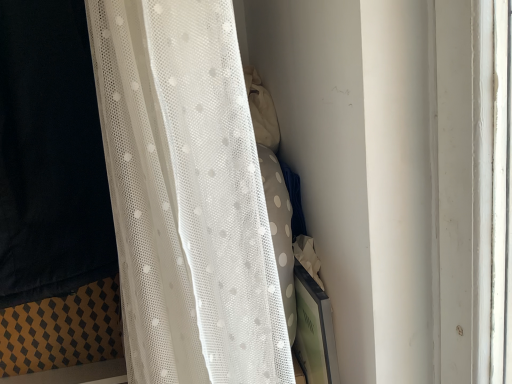
What do you see at coordinates (186, 196) in the screenshot? I see `white sheer fabric at center` at bounding box center [186, 196].

In order to face white sheer fabric at center, should I rotate leftwards or rightwards?

To face it directly, rotate left by 10.190 degrees.

Measure the distance between white sheer fabric at center and camera.

15.13 inches.

I want to click on white sheer fabric at center, so click(x=186, y=196).

The height and width of the screenshot is (384, 512). Identify the location of white sheer fabric at center. (186, 196).